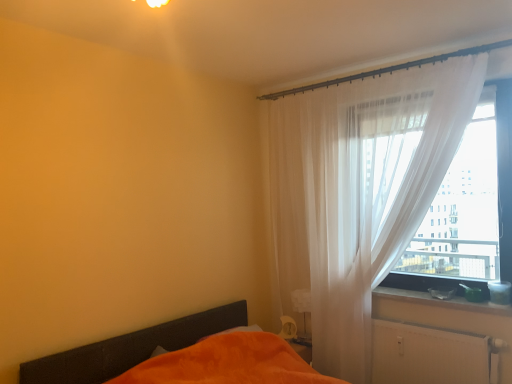
Question: Is white matte radiator at lower right completely or partially inside orange fabric bed at lower left?

Choices:
 (A) no
 (B) yes

Answer: (A)

Question: From a real-world perspective, is orange fabric bed at lower left on top of white matte radiator at lower right?

Choices:
 (A) no
 (B) yes

Answer: (A)

Question: Can you confirm if orange fabric bed at lower left is thinner than white matte radiator at lower right?

Choices:
 (A) yes
 (B) no

Answer: (B)

Question: Is orange fabric bed at lower left smaller than white matte radiator at lower right?

Choices:
 (A) yes
 (B) no

Answer: (B)

Question: From a real-world perspective, is orange fabric bed at lower left beneath white matte radiator at lower right?

Choices:
 (A) yes
 (B) no

Answer: (A)

Question: In terms of height, does transparent fabric at right look taller or shorter compared to white sheer curtain at right?

Choices:
 (A) short
 (B) tall

Answer: (A)

Question: In the image, is transparent fabric at right positioned in front of or behind white sheer curtain at right?

Choices:
 (A) behind
 (B) front

Answer: (A)

Question: In terms of size, does transparent fabric at right appear bigger or smaller than white sheer curtain at right?

Choices:
 (A) small
 (B) big

Answer: (A)

Question: In the image, is transparent fabric at right on the left side or the right side of white sheer curtain at right?

Choices:
 (A) right
 (B) left

Answer: (A)

Question: Is white sheer curtain at right to the left or to the right of transparent fabric at right in the image?

Choices:
 (A) right
 (B) left

Answer: (B)

Question: In the image, is white sheer curtain at right positioned in front of or behind transparent fabric at right?

Choices:
 (A) behind
 (B) front

Answer: (B)

Question: Is white sheer curtain at right bigger or smaller than transparent fabric at right?

Choices:
 (A) small
 (B) big

Answer: (B)

Question: Looking at their shapes, would you say white sheer curtain at right is wider or thinner than transparent fabric at right?

Choices:
 (A) thin
 (B) wide

Answer: (B)

Question: From a real-world perspective, is white sheer curtain at right positioned above or below matte plastic container at right?

Choices:
 (A) below
 (B) above

Answer: (B)

Question: Based on their positions, is white sheer curtain at right located to the left or right of matte plastic container at right?

Choices:
 (A) left
 (B) right

Answer: (A)